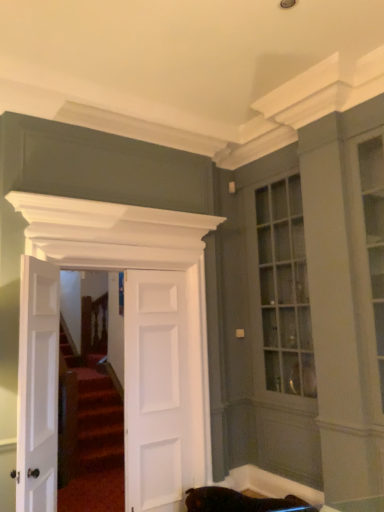
Question: Is white matte door at center, which is counted as the 2th door, starting from the left, behind white matte door at left, the 3th door when ordered from right to left?

Choices:
 (A) yes
 (B) no

Answer: (A)

Question: Is white matte door at center, which is counted as the 2th door, starting from the left, facing towards white matte door at left, marked as the first door in a left-to-right arrangement?

Choices:
 (A) no
 (B) yes

Answer: (A)

Question: Could white matte door at left, the 3th door when ordered from right to left, be considered to be inside white matte door at center, which is counted as the 2th door, starting from the left?

Choices:
 (A) no
 (B) yes

Answer: (A)

Question: Is white matte door at center, the 2th door positioned from the right, far away from white matte door at left, the 3th door when ordered from right to left?

Choices:
 (A) yes
 (B) no

Answer: (B)

Question: Is white matte door at center, the 2th door positioned from the right, at the right side of white matte door at left, marked as the first door in a left-to-right arrangement?

Choices:
 (A) no
 (B) yes

Answer: (B)

Question: Considering the relative sizes of white matte door at center, which is counted as the 2th door, starting from the left, and white matte door at left, the 3th door when ordered from right to left, in the image provided, is white matte door at center, which is counted as the 2th door, starting from the left, shorter than white matte door at left, the 3th door when ordered from right to left,?

Choices:
 (A) yes
 (B) no

Answer: (B)

Question: Is white matte door at center, arranged as the first door when viewed from the right, facing away from white matte door at left, the 3th door when ordered from right to left?

Choices:
 (A) no
 (B) yes

Answer: (A)

Question: Are white matte door at center, arranged as the first door when viewed from the right, and white matte door at left, the 3th door when ordered from right to left, located far from each other?

Choices:
 (A) yes
 (B) no

Answer: (B)

Question: From the image's perspective, is white matte door at center, arranged as the first door when viewed from the right, on top of white matte door at left, marked as the first door in a left-to-right arrangement?

Choices:
 (A) yes
 (B) no

Answer: (B)

Question: Is white matte door at left, the 3th door when ordered from right to left, inside white matte door at center, the 3th door positioned from the left?

Choices:
 (A) no
 (B) yes

Answer: (A)

Question: From the image's perspective, is white matte door at center, the 3th door positioned from the left, under white matte door at left, marked as the first door in a left-to-right arrangement?

Choices:
 (A) no
 (B) yes

Answer: (B)

Question: Considering the relative positions of white matte door at center, arranged as the first door when viewed from the right, and white matte door at left, the 3th door when ordered from right to left, in the image provided, is white matte door at center, arranged as the first door when viewed from the right, to the left of white matte door at left, the 3th door when ordered from right to left, from the viewer's perspective?

Choices:
 (A) no
 (B) yes

Answer: (A)

Question: Does white matte door at left, the 3th door when ordered from right to left, lie in front of white matte door at center, which is counted as the 2th door, starting from the left?

Choices:
 (A) yes
 (B) no

Answer: (A)